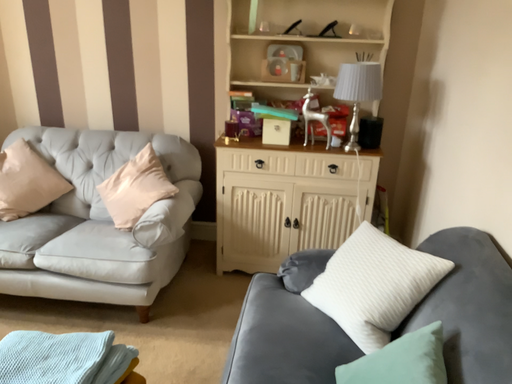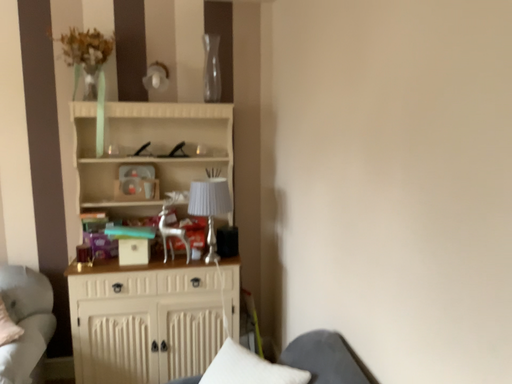
Question: How did the camera likely rotate when shooting the video?

Choices:
 (A) rotated downward
 (B) rotated upward

Answer: (B)